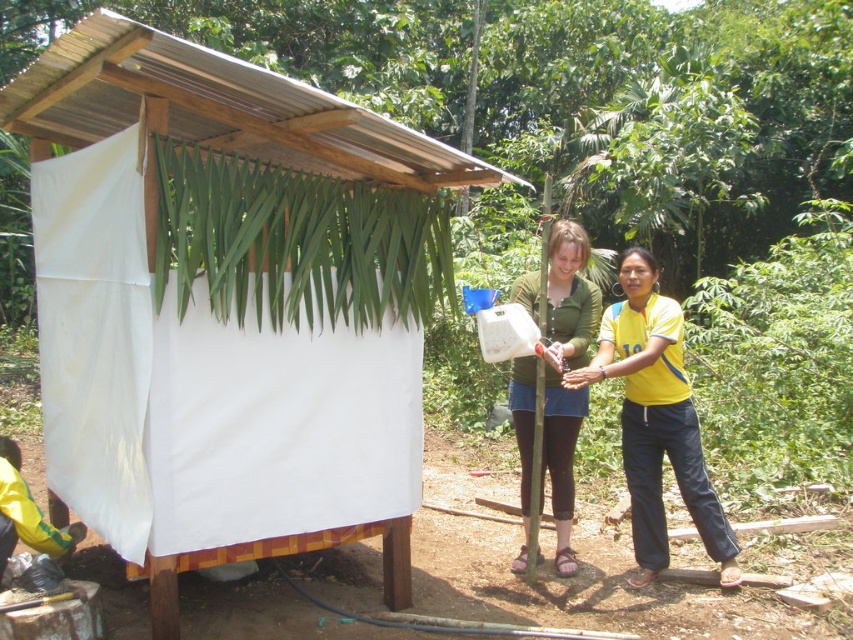
You are a photographer setting up a shoot near the white fabric shelter at center and the yellow fabric pants at center. You want to ensure the shelter is visible in the background while the pants remain in the foreground. Based on their positions, is this arrangement possible?

The white fabric shelter at center is positioned over the yellow fabric pants at center, meaning the shelter is behind the pants. This allows the photographer to have the shelter in the background and the pants in the foreground as desired.